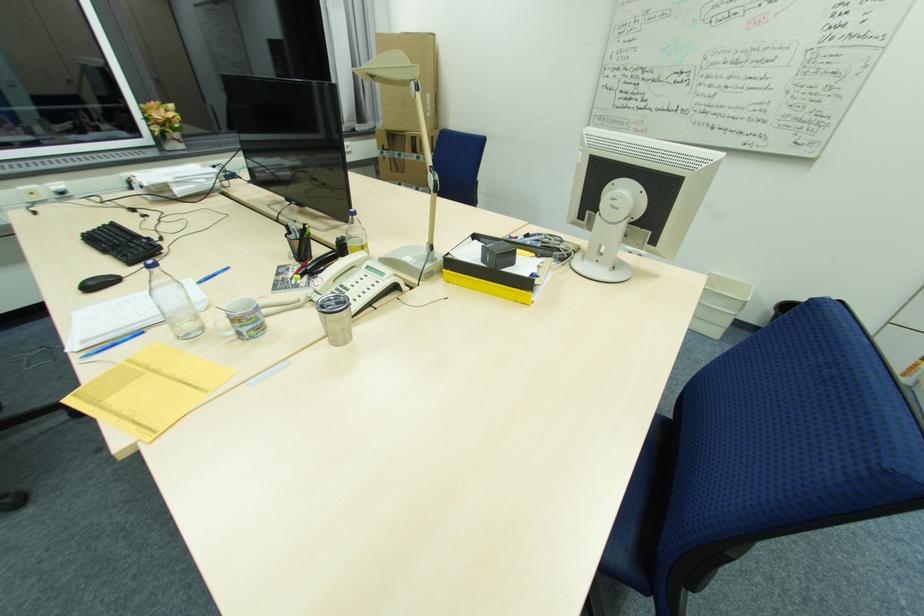
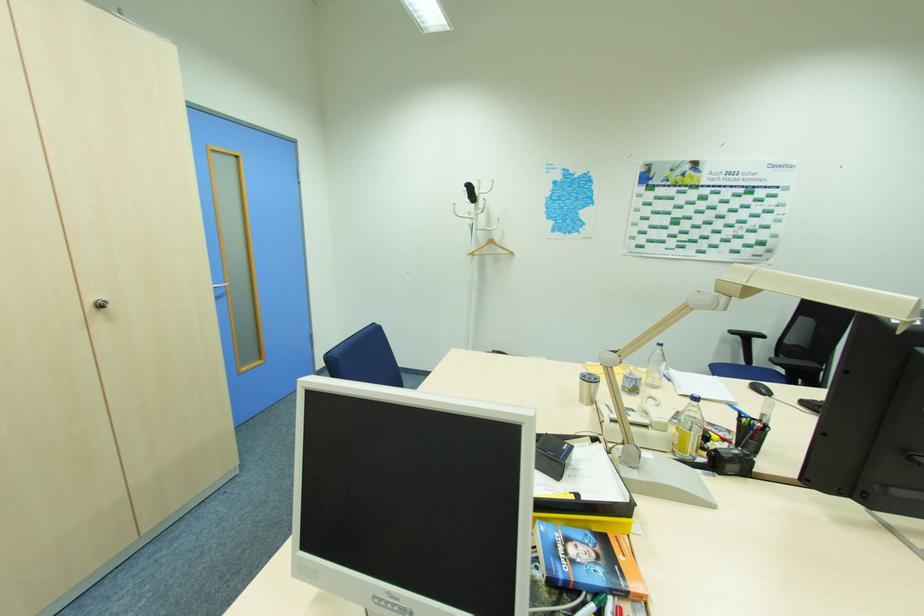
Locate, in the second image, the point that corresponds to the point at 157,270 in the first image.

(663, 347)